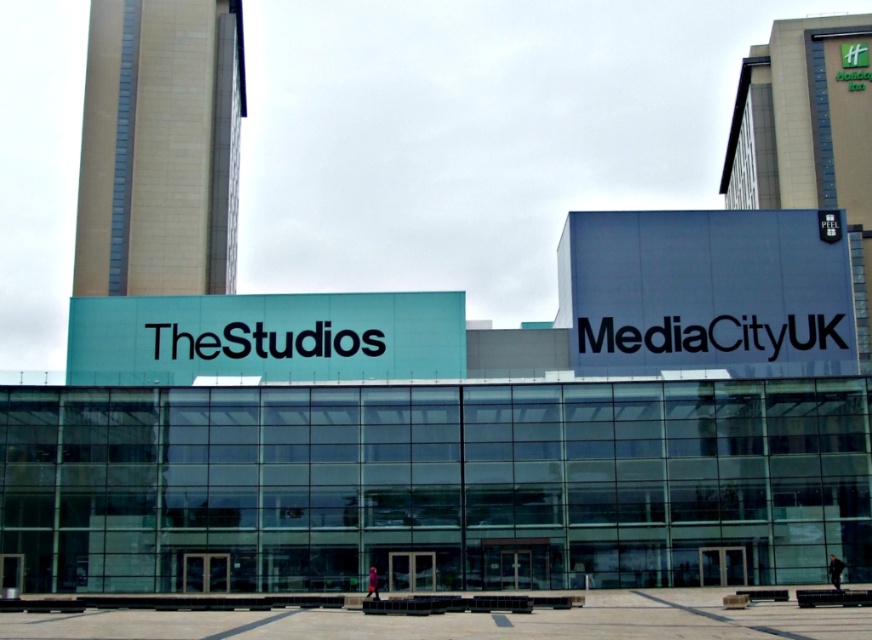
Can you confirm if beige brick tower at upper left is bigger than green glass tower at upper right?

Incorrect, beige brick tower at upper left is not larger than green glass tower at upper right.

Does beige brick tower at upper left appear under green glass tower at upper right?

Indeed, beige brick tower at upper left is positioned under green glass tower at upper right.

Locate an element on the screen. The height and width of the screenshot is (640, 872). beige brick tower at upper left is located at coordinates (x=159, y=147).